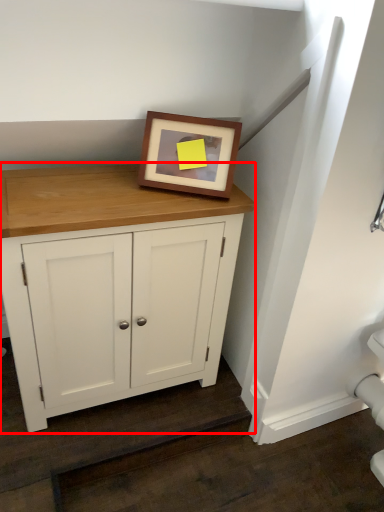
Question: Where is cupboard (annotated by the red box) located in relation to picture frame in the image?

Choices:
 (A) left
 (B) right

Answer: (A)